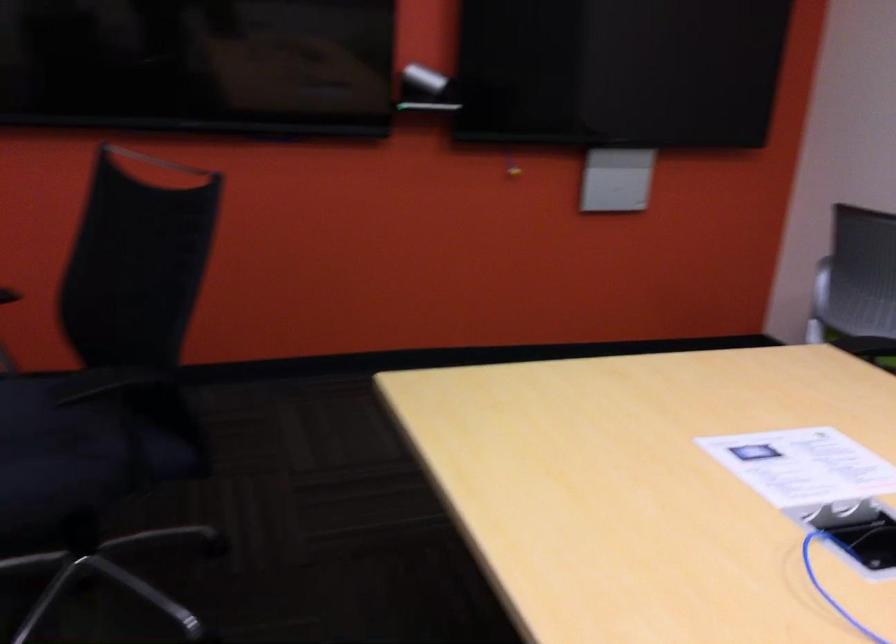
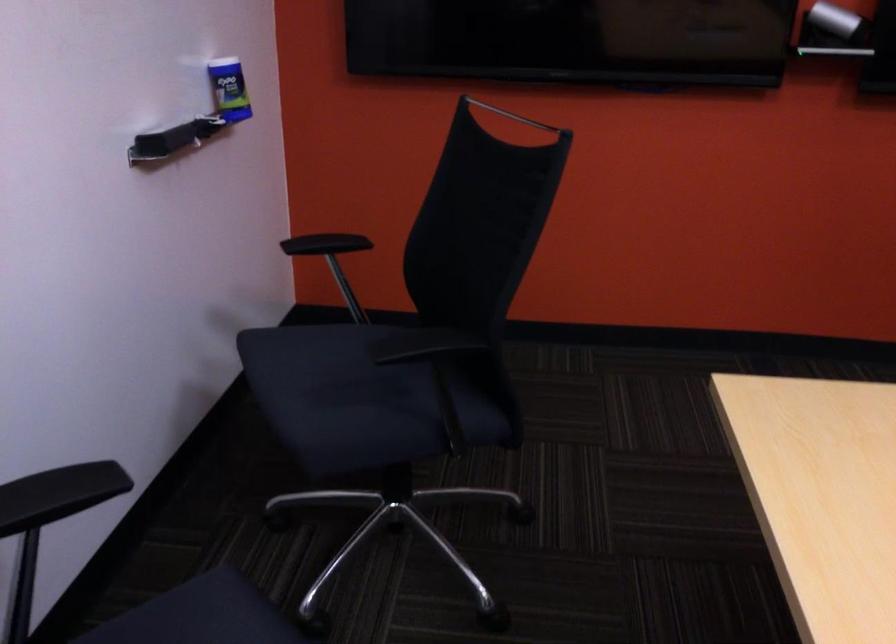
Question: What movement of the cameraman would produce the second image?

Choices:
 (A) Left
 (B) Right
 (C) Forward
 (D) Backward

Answer: (C)